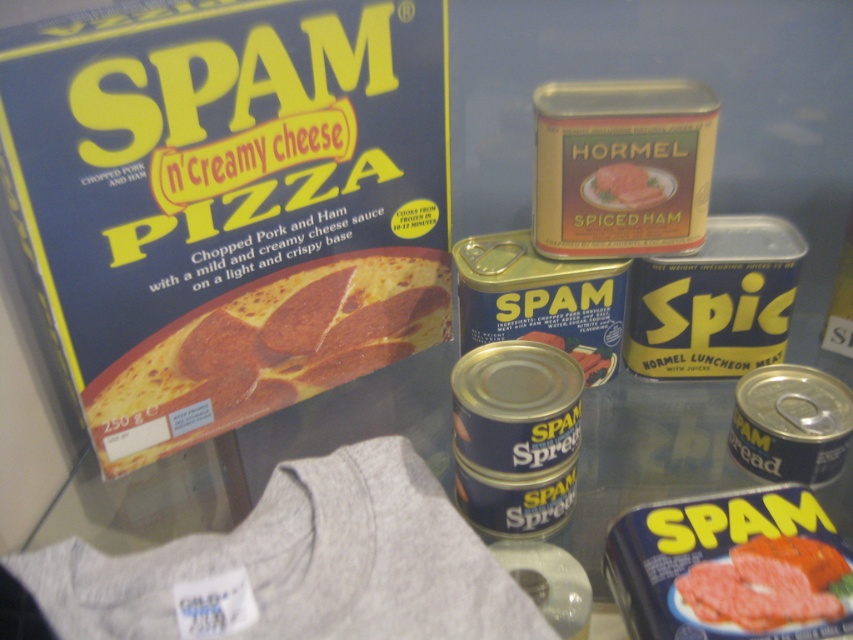
You are holding a ruler and want to measure the distance between yourself and the yellow matte pizza at upper left. If the ruler is 12 inches long, can you reach the entire length of the pizza with just one ruler?

The yellow matte pizza at upper left is 30.12 inches from viewer. Since the ruler is only 12 inches long, you cannot measure the entire distance with one ruler.

You are a food inspector checking the height of the hams in the image. Which ham is taller between the smooth pink ham at center and the spiced ham at center?

The smooth pink ham at center is much taller than the spiced ham at center.

You are a grocery store employee arranging SPAM products. You need to place a new sign that should be visible behind both the yellow matte pizza at upper left and the spiced ham at center. Where should you position the sign?

The sign should be placed behind both the yellow matte pizza at upper left and the spiced ham at center, but since the yellow matte pizza at upper left is in front of the spiced ham at center, the sign must be positioned behind the spiced ham at center to ensure visibility behind both objects.